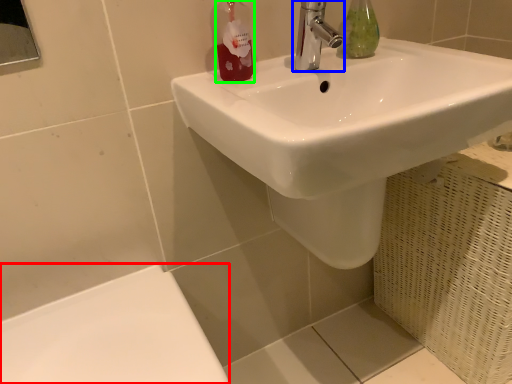
Question: Based on their relative distances, which object is farther from porcelain (highlighted by a red box)? Choose from tap (highlighted by a blue box) and toiletry (highlighted by a green box).

Choices:
 (A) tap
 (B) toiletry

Answer: (A)